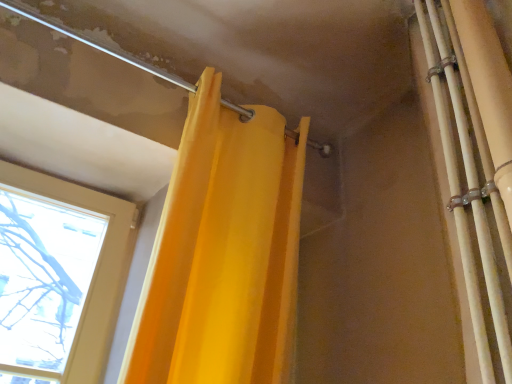
Question: Can we say matte yellow curtain at upper left lies outside matte metal pipe at upper left?

Choices:
 (A) no
 (B) yes

Answer: (B)

Question: Considering the relative positions of matte yellow curtain at upper left and matte metal pipe at upper left in the image provided, is matte yellow curtain at upper left behind matte metal pipe at upper left?

Choices:
 (A) no
 (B) yes

Answer: (A)

Question: Does matte yellow curtain at upper left have a lesser width compared to matte metal pipe at upper left?

Choices:
 (A) no
 (B) yes

Answer: (B)

Question: Could matte metal pipe at upper left be considered to be inside matte yellow curtain at upper left?

Choices:
 (A) no
 (B) yes

Answer: (A)

Question: From a real-world perspective, is matte yellow curtain at upper left physically above matte metal pipe at upper left?

Choices:
 (A) no
 (B) yes

Answer: (A)

Question: From the image's perspective, is matte yellow curtain at upper left above matte metal pipe at upper left?

Choices:
 (A) yes
 (B) no

Answer: (B)

Question: Can you confirm if matte metal pipe at upper left is smaller than matte yellow curtain at upper left?

Choices:
 (A) no
 (B) yes

Answer: (B)

Question: Does matte metal pipe at upper left have a lesser height compared to matte yellow curtain at upper left?

Choices:
 (A) yes
 (B) no

Answer: (A)

Question: Can you confirm if matte metal pipe at upper left is taller than matte yellow curtain at upper left?

Choices:
 (A) no
 (B) yes

Answer: (A)

Question: From the image's perspective, does matte metal pipe at upper left appear lower than matte yellow curtain at upper left?

Choices:
 (A) no
 (B) yes

Answer: (A)

Question: Considering the relative positions of matte metal pipe at upper left and matte yellow curtain at upper left in the image provided, is matte metal pipe at upper left to the right of matte yellow curtain at upper left from the viewer's perspective?

Choices:
 (A) no
 (B) yes

Answer: (A)

Question: From a real-world perspective, is matte metal pipe at upper left over matte yellow curtain at upper left?

Choices:
 (A) yes
 (B) no

Answer: (A)

Question: Relative to matte yellow curtain at upper left, is matte metal pipe at upper left in front or behind?

Choices:
 (A) behind
 (B) front

Answer: (A)